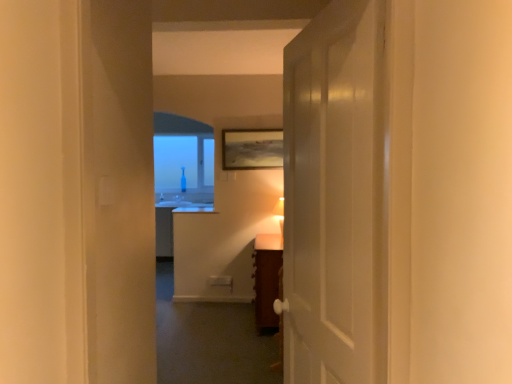
Question: Looking at the image, does brown wooden vanity at center seem bigger or smaller compared to white glossy door at center?

Choices:
 (A) small
 (B) big

Answer: (B)

Question: Is brown wooden vanity at center in front of or behind white glossy door at center in the image?

Choices:
 (A) behind
 (B) front

Answer: (A)

Question: Estimate the real-world distances between objects in this image. Which object is closer to the transparent glass bottle at center?

Choices:
 (A) matte wooden picture frame at upper center
 (B) brown wooden vanity at center
 (C) white glossy door at center
 (D) matte white table lamp at center

Answer: (A)

Question: Which object is the closest to the white glossy door at center?

Choices:
 (A) matte wooden picture frame at upper center
 (B) transparent glass bottle at center
 (C) matte white table lamp at center
 (D) brown wooden vanity at center

Answer: (D)